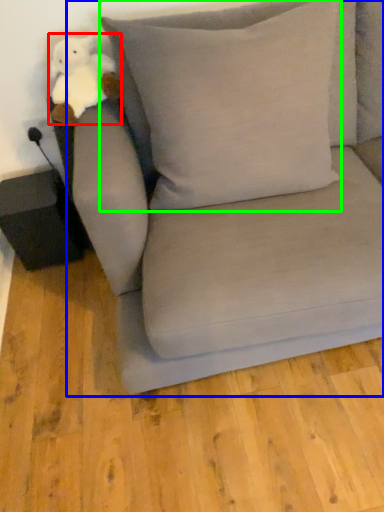
Question: Estimate the real-world distances between objects in this image. Which object is farther from toy (highlighted by a red box), studio couch (highlighted by a blue box) or pillow (highlighted by a green box)?

Choices:
 (A) studio couch
 (B) pillow

Answer: (A)